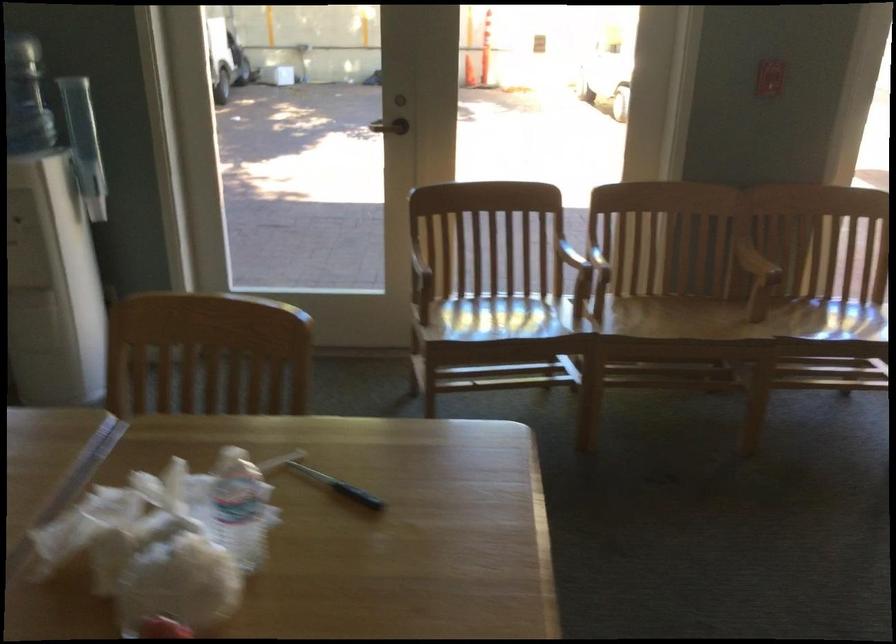
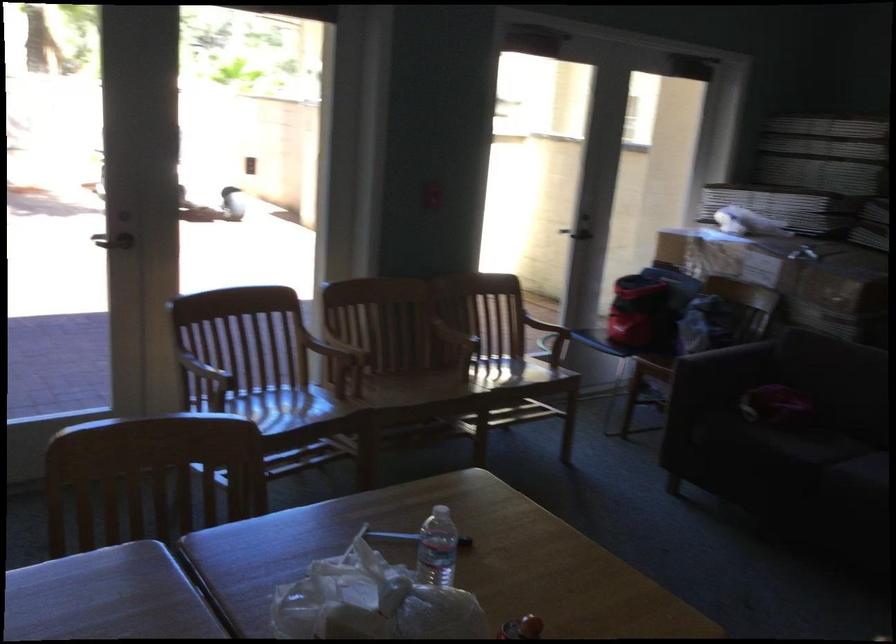
Where in the second image is the point corresponding to the point at 427,259 from the first image?

(205, 371)